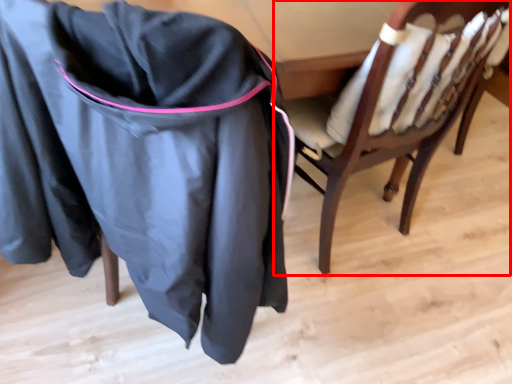
Question: From the image's perspective, considering the relative positions of chair (annotated by the red box) and clothing in the image provided, where is chair (annotated by the red box) located with respect to the staircase?

Choices:
 (A) above
 (B) below

Answer: (A)